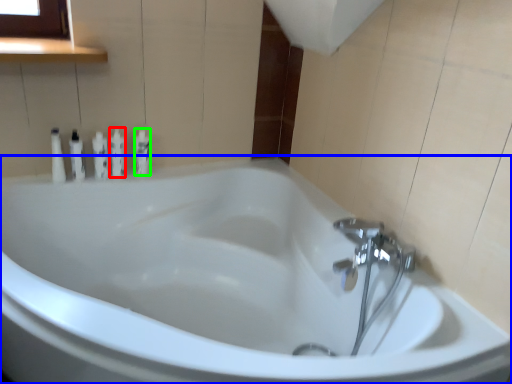
Question: Which is farther away from toiletry (highlighted by a red box)? bathtub (highlighted by a blue box) or toiletry (highlighted by a green box)?

Choices:
 (A) bathtub
 (B) toiletry

Answer: (A)